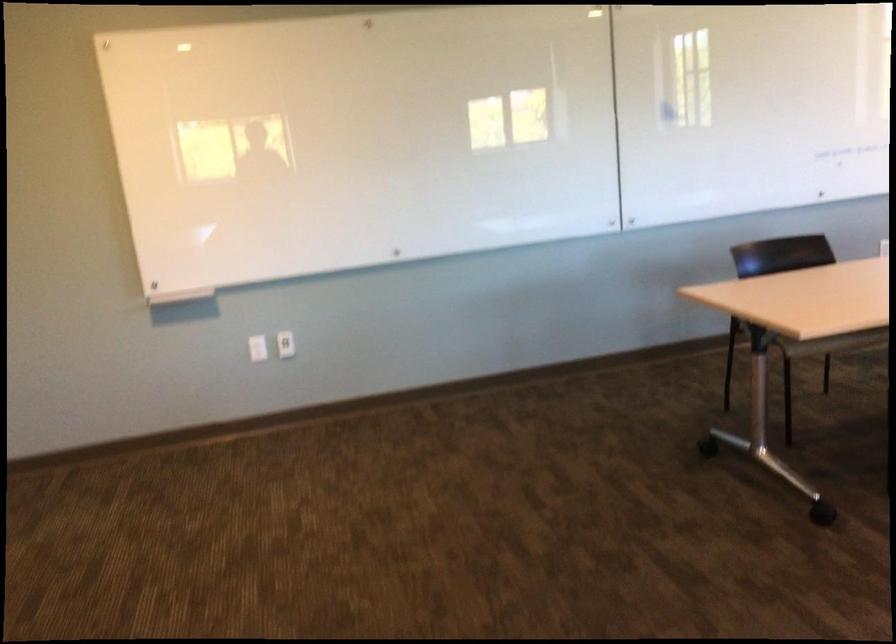
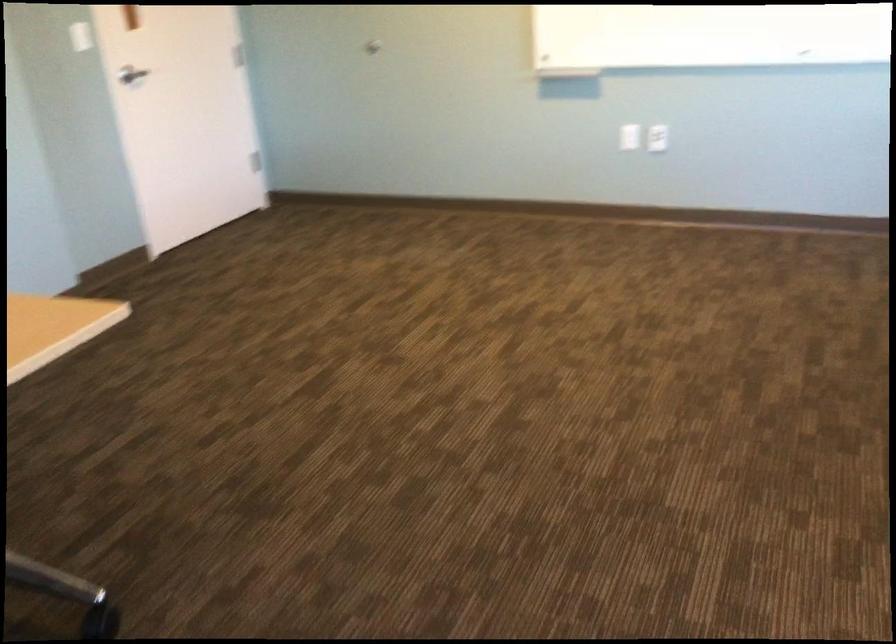
Locate, in the second image, the point that corresponds to [288,348] in the first image.

(657, 138)